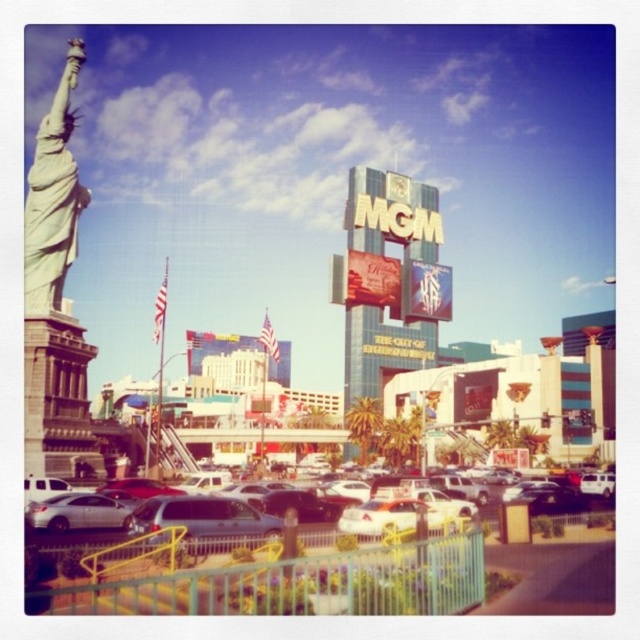
You are a tour guide in Las Vegas and want to park your silver metallic sedan at center close to the white marble statue at left. Is there enough space between them for a 1.5 meter wide tour bus to pass through?

The silver metallic sedan at center might be wider than white marble statue at left, so there might not be enough space for the 1.5 meter wide tour bus to pass through.

You are a tourist standing in front of the MGM Grand hotel and casino. You see a silver metallic sedan at center and a white marble statue at left. Which object is positioned lower in the scene?

The silver metallic sedan at center is positioned lower than the white marble statue at left.